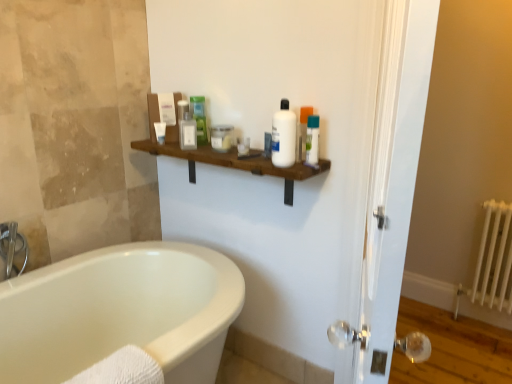
Question: Would you say white glossy screen door at right is inside or outside brushed metal faucet at left?

Choices:
 (A) inside
 (B) outside

Answer: (B)

Question: From their relative heights in the image, would you say white glossy screen door at right is taller or shorter than brushed metal faucet at left?

Choices:
 (A) tall
 (B) short

Answer: (A)

Question: Which object is positioned closest to the white glossy lotion at upper center, which is counted as the first toiletry, starting from the right?

Choices:
 (A) white plastic bottle at center
 (B) clear plastic container at upper center, marked as the 6th toiletry in a right-to-left arrangement
 (C) white glossy screen door at right
 (D) translucent plastic cup at center, placed as the 3th toiletry when sorted from right to left
 (E) green matte tube at upper center, the fifth toiletry viewed from the right

Answer: (A)

Question: Which is nearer to the brushed metal faucet at left?

Choices:
 (A) matte glass jar at center, acting as the fourth toiletry starting from the right
 (B) clear plastic container at upper center, which appears as the 3th toiletry when viewed from the left
 (C) translucent plastic bottle at center, positioned as the 2th toiletry in right-to-left order
 (D) translucent plastic cup at center, acting as the sixth toiletry starting from the left
 (E) white metal radiator at right

Answer: (B)